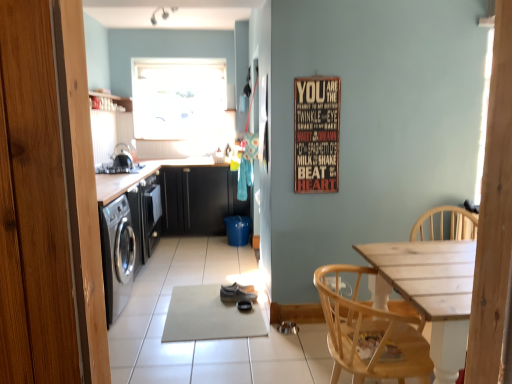
Question: Is transparent glass window at upper center further to camera compared to light wood chair at lower right?

Choices:
 (A) no
 (B) yes

Answer: (B)

Question: Could you tell me if transparent glass window at upper center is turned towards light wood chair at lower right?

Choices:
 (A) no
 (B) yes

Answer: (B)

Question: Is light wood chair at lower right located within transparent glass window at upper center?

Choices:
 (A) yes
 (B) no

Answer: (B)

Question: Can you confirm if transparent glass window at upper center is positioned to the left of light wood chair at lower right?

Choices:
 (A) yes
 (B) no

Answer: (A)

Question: Considering the relative sizes of transparent glass window at upper center and light wood chair at lower right in the image provided, is transparent glass window at upper center smaller than light wood chair at lower right?

Choices:
 (A) yes
 (B) no

Answer: (A)

Question: From the image's perspective, does transparent glass window at upper center appear higher than light wood chair at lower right?

Choices:
 (A) no
 (B) yes

Answer: (B)

Question: Does transparent glass window at upper center appear on the right side of satin black stove at upper left?

Choices:
 (A) no
 (B) yes

Answer: (B)

Question: From a real-world perspective, is transparent glass window at upper center on satin black stove at upper left?

Choices:
 (A) yes
 (B) no

Answer: (A)

Question: Is transparent glass window at upper center further to camera compared to satin black stove at upper left?

Choices:
 (A) no
 (B) yes

Answer: (B)

Question: Can you confirm if transparent glass window at upper center is thinner than satin black stove at upper left?

Choices:
 (A) yes
 (B) no

Answer: (A)

Question: Is transparent glass window at upper center in contact with satin black stove at upper left?

Choices:
 (A) yes
 (B) no

Answer: (B)

Question: Is satin black stove at upper left a part of transparent glass window at upper center?

Choices:
 (A) no
 (B) yes

Answer: (A)

Question: Is satin black stove at upper left completely or partially outside of black matte cabinetry at left, the 1th cabinetry from the front?

Choices:
 (A) no
 (B) yes

Answer: (A)